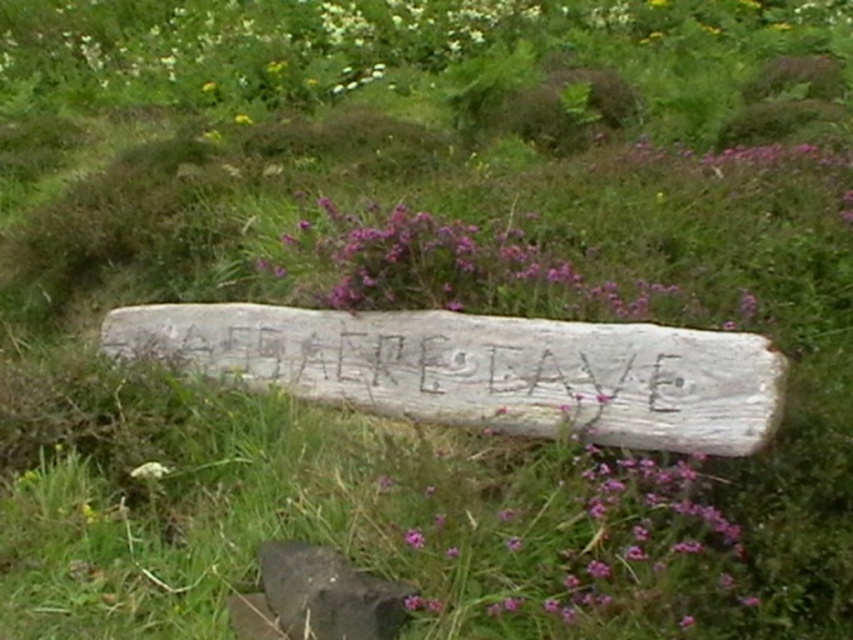
Question: Observing the image, what is the correct spatial positioning of purple wood at center in reference to white fluffy flower at lower left?

Choices:
 (A) above
 (B) below

Answer: (A)

Question: Can you confirm if smooth gray stone at lower center is positioned above white fluffy flower at lower left?

Choices:
 (A) no
 (B) yes

Answer: (A)

Question: Which point is closer to the camera taking this photo?

Choices:
 (A) click(x=289, y=545)
 (B) click(x=157, y=474)

Answer: (A)

Question: Which of the following is the closest to the observer?

Choices:
 (A) (573, 301)
 (B) (154, 476)

Answer: (B)

Question: Which point is closer to the camera taking this photo?

Choices:
 (A) (329, 230)
 (B) (392, 630)

Answer: (B)

Question: Can you confirm if purple wood at center is positioned to the left of smooth gray stone at lower center?

Choices:
 (A) yes
 (B) no

Answer: (B)